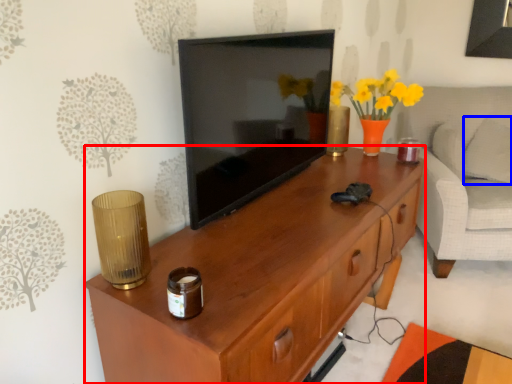
Question: Which object appears closest to the camera in this image, desk (highlighted by a red box) or pillow (highlighted by a blue box)?

Choices:
 (A) desk
 (B) pillow

Answer: (A)